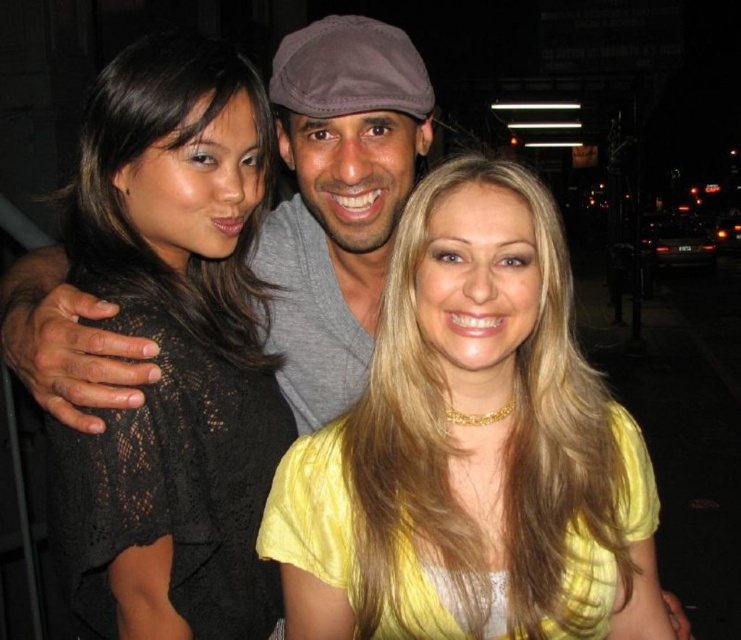
You are a photographer trying to adjust the lighting for a group photo. You notice the yellow matte shirt at center and the black lace top at left. Which clothing item requires more space in the frame to avoid being cut off?

The yellow matte shirt at center requires more space in the frame because its width is larger than the black lace top at left, so it is more likely to be cut off if not given enough space.